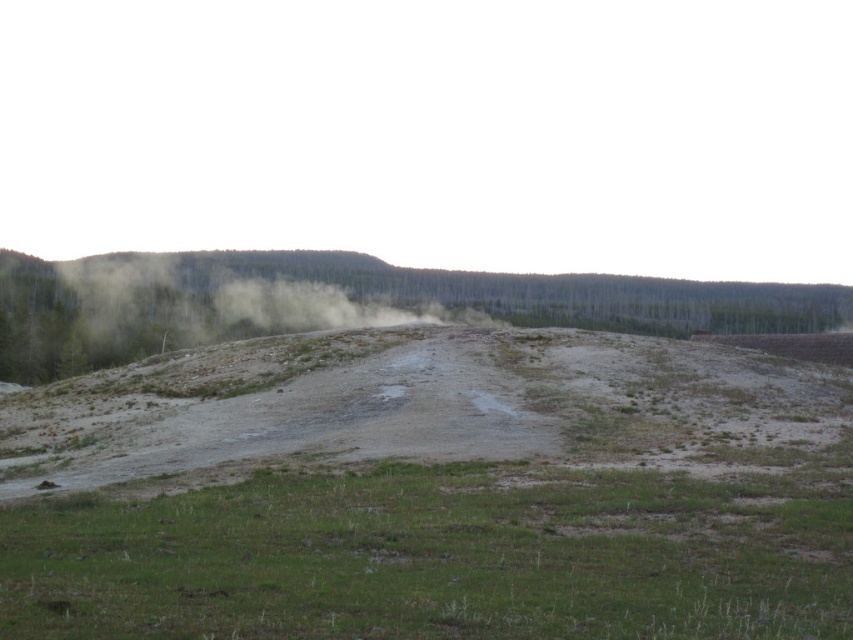
Can you confirm if green fog at upper center is positioned to the left of green grassy at lower center?

Correct, you'll find green fog at upper center to the left of green grassy at lower center.

From the picture: Is green fog at upper center below green grassy at lower center?

No.

Does point (669, 70) lie behind point (128, 634)?

Yes, point (669, 70) is farther from viewer.

This screenshot has width=853, height=640. Identify the location of green fog at upper center. (436, 132).

Does green grassy at lower center appear on the left side of green leafy tree at center?

Yes, green grassy at lower center is to the left of green leafy tree at center.

Can you confirm if green grassy at lower center is positioned above green leafy tree at center?

Incorrect, green grassy at lower center is not positioned above green leafy tree at center.

Locate an element on the screen. This screenshot has height=640, width=853. green grassy at lower center is located at coordinates (439, 557).

Is green fog at upper center shorter than green leafy tree at center?

No.

Locate an element on the screen. green fog at upper center is located at coordinates (436, 132).